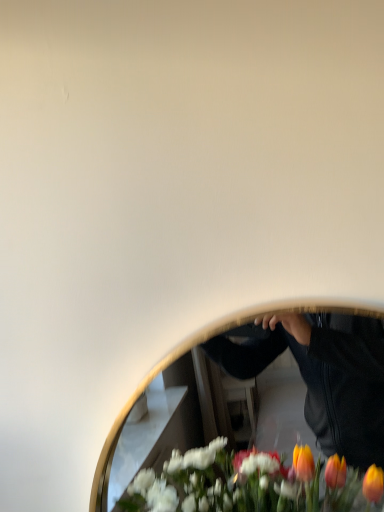
Identify the location of metallic circular mirror at center. This screenshot has height=512, width=384. (321, 373).

This screenshot has height=512, width=384. Describe the element at coordinates (321, 373) in the screenshot. I see `metallic circular mirror at center` at that location.

Locate an element on the screen. The height and width of the screenshot is (512, 384). metallic circular mirror at center is located at coordinates (321, 373).